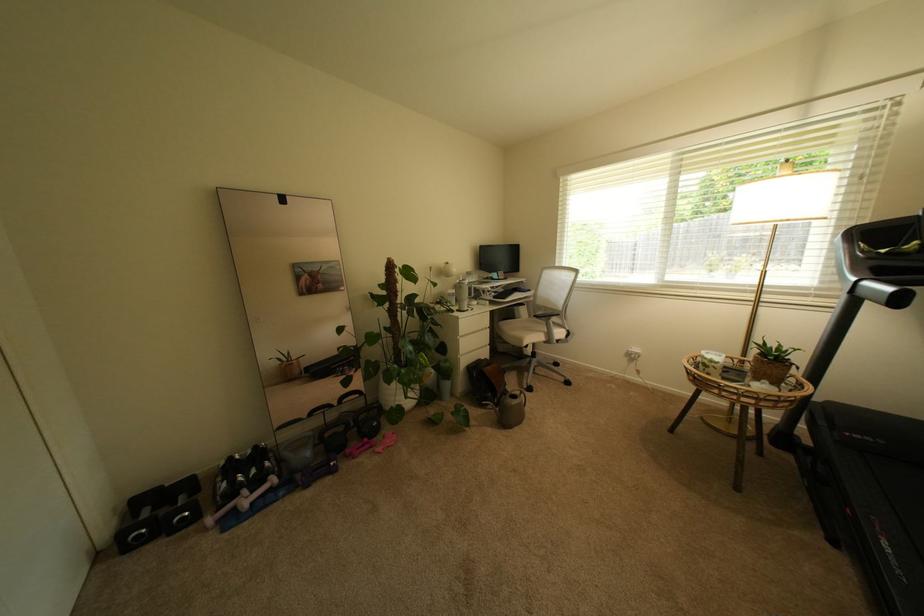
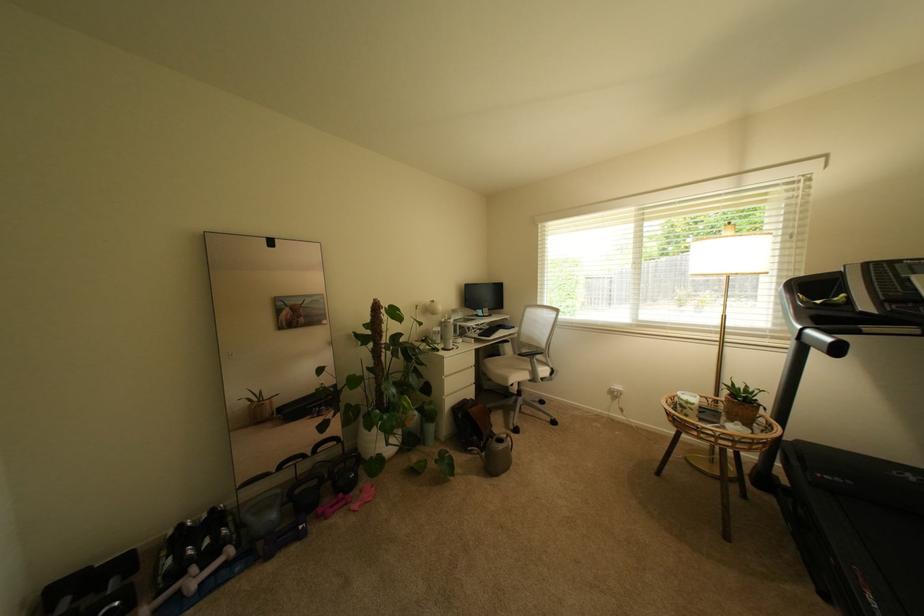
In the second image, find the point that corresponds to (x=466, y=310) in the first image.

(451, 347)